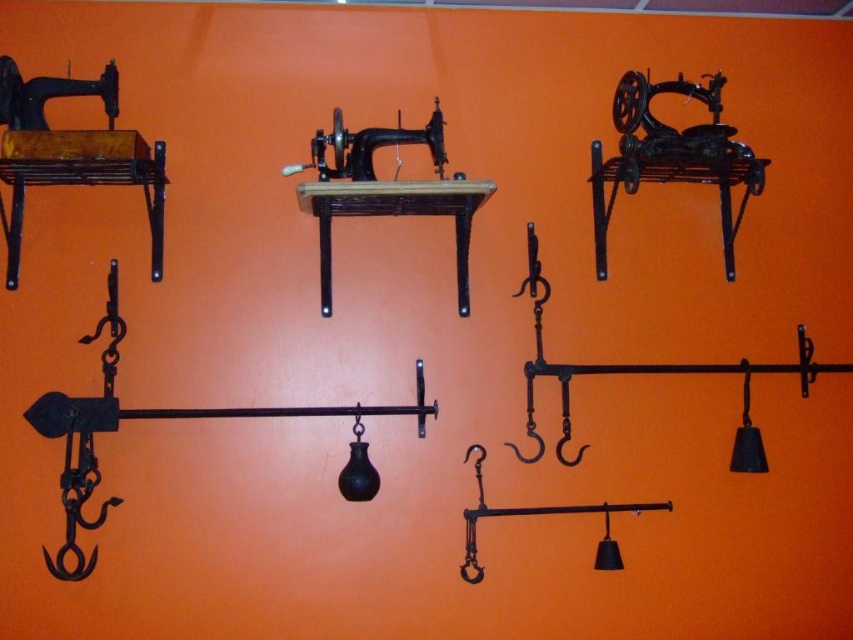
You are a museum curator arranging an exhibition. You have two sewing machines displayed on the wall, the matte black sewing machine at upper left and the black cast iron sewing machine at upper right. You need to place a label between them that must be at least 30 inches wide. Will the space between them accommodate the label?

The matte black sewing machine at upper left is 36.04 inches from the black cast iron sewing machine at upper right. Since the required label is at least 30 inches wide, the space between them is sufficient to accommodate the label as 36.04 inches is greater than 30 inches.

You are an interior designer planning to place a decorative item between the black cast iron sewing machine at upper right and the black matte sewing machine at center. Considering their widths, which sewing machine should the item be closer to to ensure it fits better?

The black cast iron sewing machine at upper right has a lesser width compared to the black matte sewing machine at center, so the decorative item should be placed closer to the black cast iron sewing machine at upper right to ensure it fits better.

You are an interior designer planning to hang two vintage sewing machines on a wall. The space available is limited. Which of the two sewing machines, the matte black sewing machine at upper left or the black matte sewing machine at center, would be more suitable for a smaller area?

The matte black sewing machine at upper left occupies less space than the black matte sewing machine at center, making it more suitable for a smaller area.